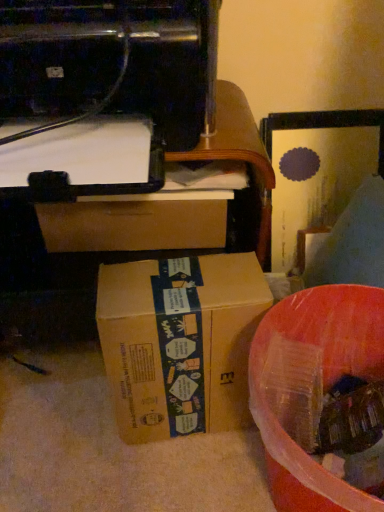
Question: Choose the correct answer: Is brown cardboard box at center inside black plastic printer at upper left or outside it?

Choices:
 (A) inside
 (B) outside

Answer: (B)

Question: From the image's perspective, is brown cardboard box at center positioned above or below black plastic printer at upper left?

Choices:
 (A) below
 (B) above

Answer: (A)

Question: Considering the real-world distances, which object is farthest from the black plastic printer at upper left?

Choices:
 (A) brown cardboard box at center
 (B) translucent plastic container at lower right

Answer: (B)

Question: Which of these objects is positioned closest to the black plastic printer at upper left?

Choices:
 (A) translucent plastic container at lower right
 (B) brown cardboard box at center

Answer: (B)